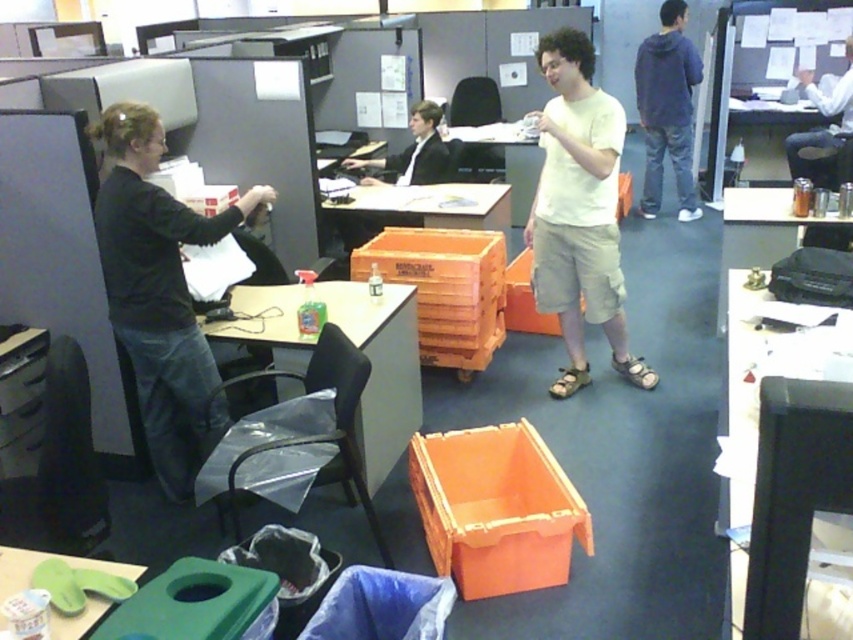
Looking at the office scene, where is the black matte shirt at upper left in relation to the blue hoodie at upper right?

The black matte shirt at upper left is to the left of the blue hoodie at upper right.

Please identify the object located at the coordinate point (381, 368) in the image. The scene has a cluttered office with orange plastic crates, a green recycling bin near a blue trash bag, and green flip flops on a desk. A person is also present. Your options are the translucent plastic table at center, the green recycling bin, the blue trash bag, or the green flip flops.

The point at (381, 368) indicates the translucent plastic table at center.

You are standing in the office and want to pick up an object located at point [126,176] and another object at point [656,211]. Which object will be easier to reach without moving your position?

The object at point [126,176] is closer to you than the object at point [656,211], so it will be easier to reach without moving your position.